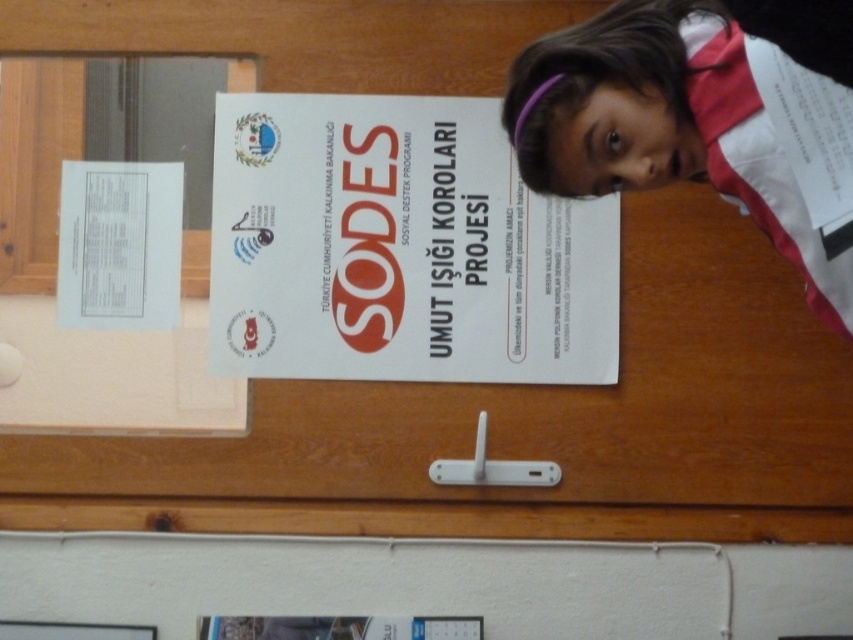
Question: Among these objects, which one is farthest from the camera?

Choices:
 (A) white paper poster at center
 (B) white fabric headband at upper right
 (C) white paper at upper left

Answer: (A)

Question: Does white fabric headband at upper right have a larger size compared to white paper at upper left?

Choices:
 (A) yes
 (B) no

Answer: (A)

Question: Which point appears closest to the camera in this image?

Choices:
 (A) (515, 72)
 (B) (173, 172)

Answer: (A)

Question: Is white fabric headband at upper right positioned behind white paper at upper left?

Choices:
 (A) yes
 (B) no

Answer: (B)

Question: Based on their relative distances, which object is farther from the white paper poster at center?

Choices:
 (A) white fabric headband at upper right
 (B) white paper at upper left

Answer: (A)

Question: Does white fabric headband at upper right come in front of white paper at upper left?

Choices:
 (A) yes
 (B) no

Answer: (A)